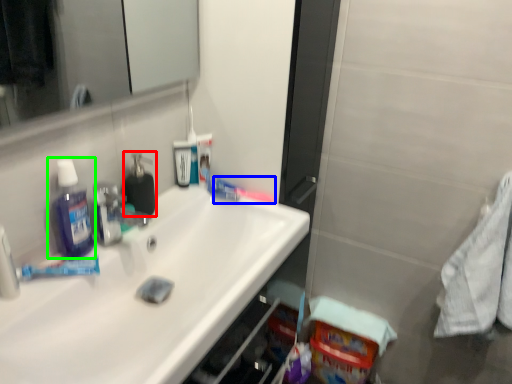
Question: Based on their relative distances, which object is farther from soap dispenser (highlighted by a red box)? Choose from toothbrush (highlighted by a blue box) and mouthwash (highlighted by a green box).

Choices:
 (A) toothbrush
 (B) mouthwash

Answer: (A)